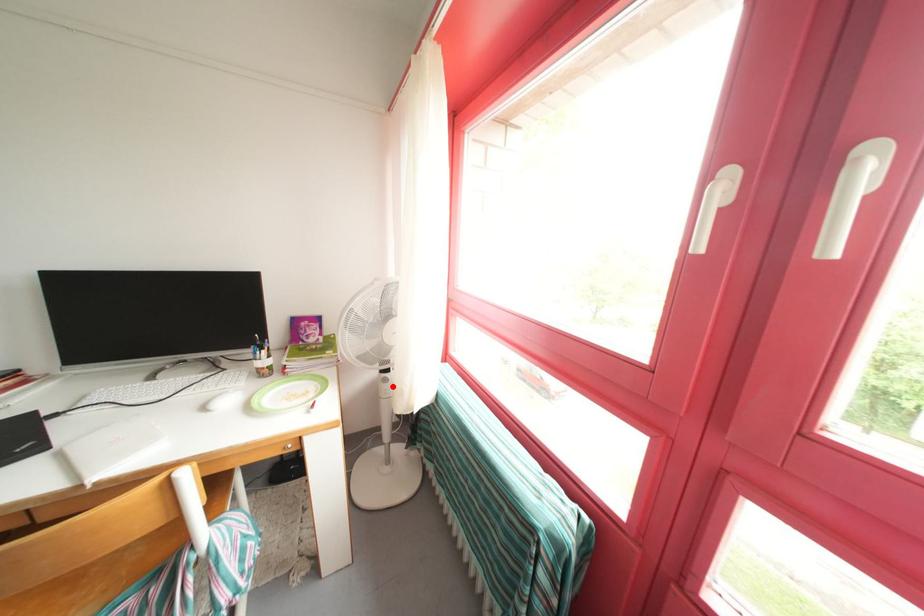
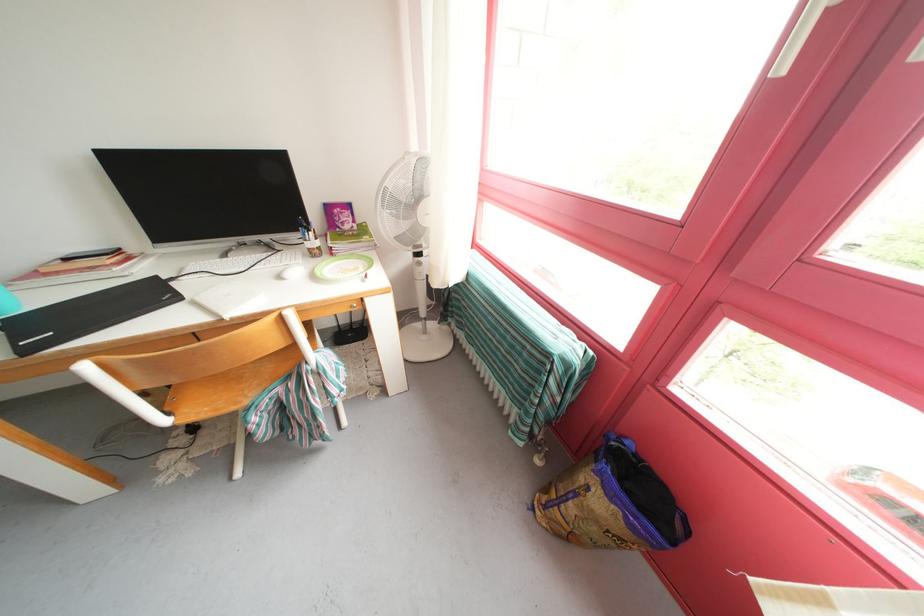
The point at the highlighted location is marked in the first image. Where is the corresponding point in the second image?

(427, 270)